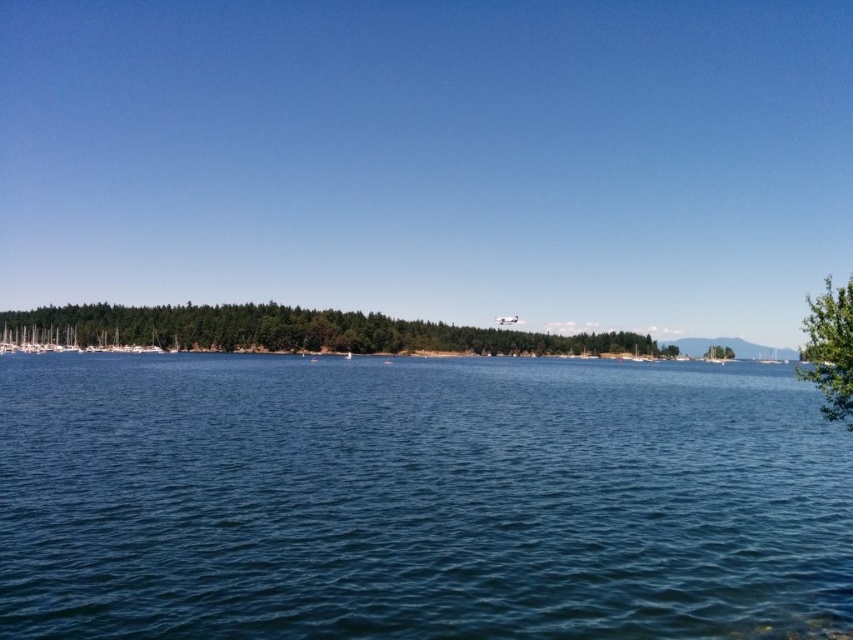
You are standing at the lakeside and want to compare the sizes of the green leafy trees at center and the green leafy tree at right. Which one appears wider?

The green leafy trees at center appears wider than the green leafy tree at right.

Based on the photo, you are a drone operator trying to capture a photo of the blue water at center. The drone is currently at point 0.781, 0.489. Is the drone positioned correctly to take the photo?

Yes, the blue water at center is located at point (416,499), so the drone is positioned correctly to take the photo.